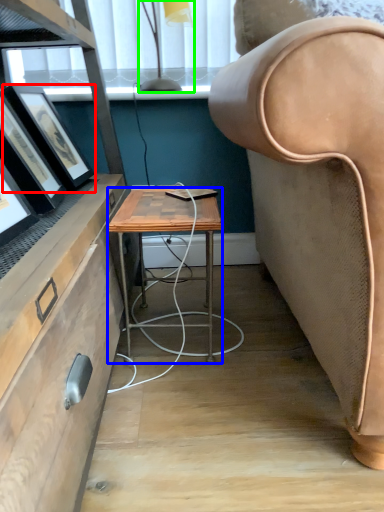
Question: Which object is positioned farthest from picture frame (highlighted by a red box)? Select from desk (highlighted by a blue box) and lamp (highlighted by a green box).

Choices:
 (A) desk
 (B) lamp

Answer: (B)